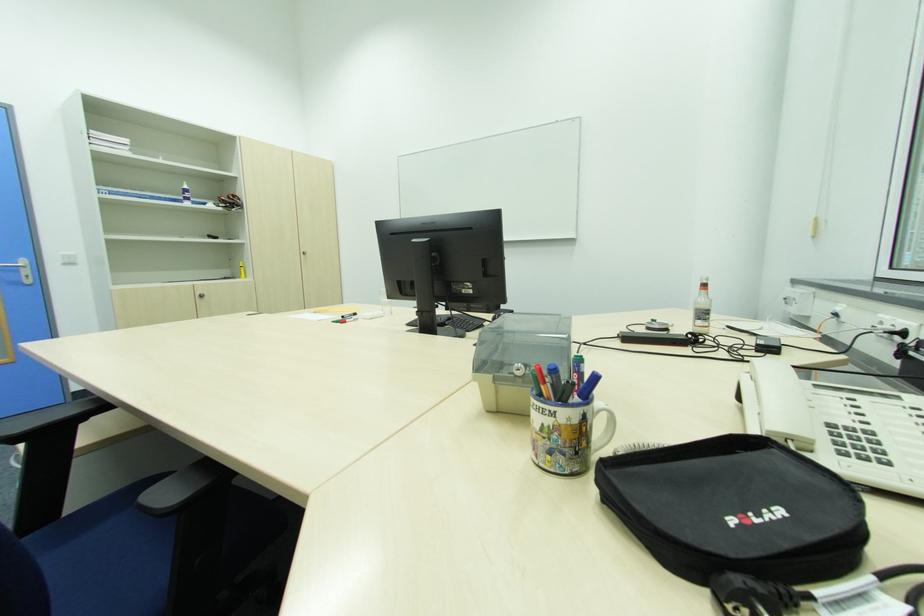
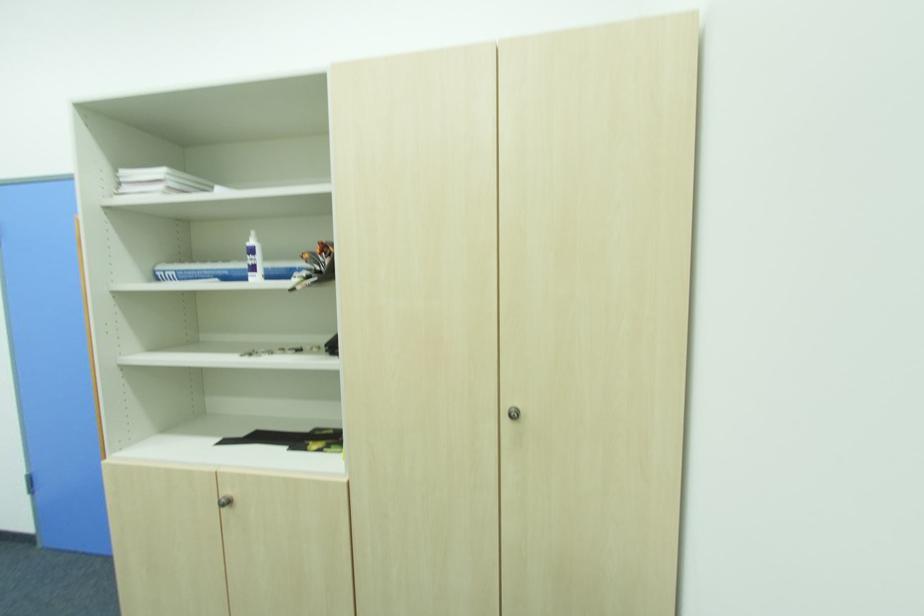
Locate, in the second image, the point that corresponds to the point at 236,198 in the first image.

(321, 252)